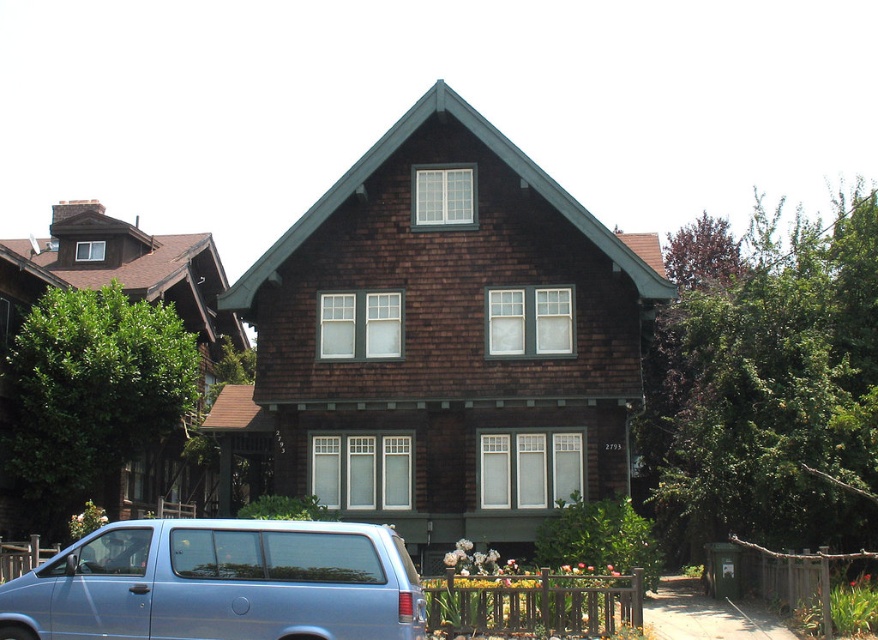
You are standing directly in front of the house and want to locate the brown shingles at center. Based on the 2D coordinates given, where would you look relative to the central dormer window?

The brown shingles at center are located at coordinates point (450, 337), which is slightly to the right and below the central dormer window.